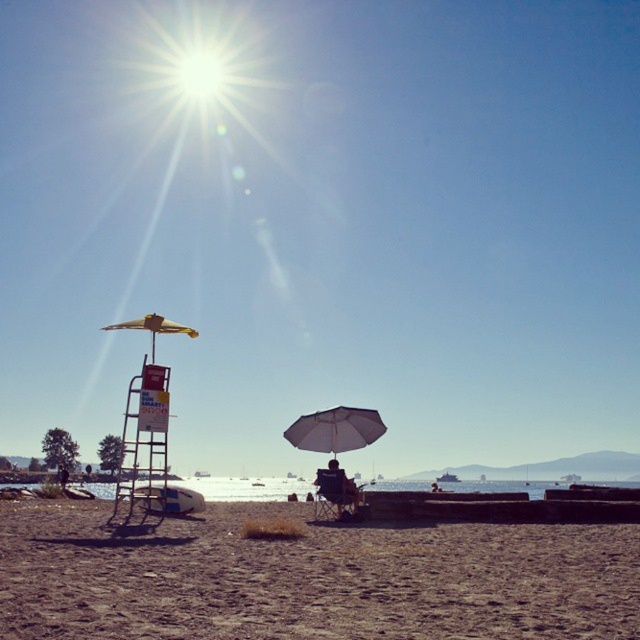
You are a photographer wanting to capture the bright yellow umbrella at upper center and the brown sandy beach at lower center in a single shot. Which object will appear larger in the photo?

The bright yellow umbrella at upper center will appear larger in the photo because it is much taller than the brown sandy beach at lower center.

You are standing at the point marked by the coordinates point (323, 224) in the beach scene. What object is located at that exact position?

The point (323, 224) marks the location of the bright yellow umbrella at upper center.